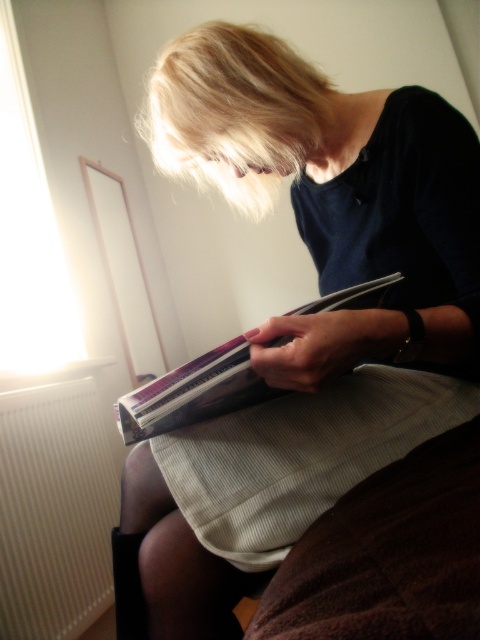
Question: Which object appears farthest from the camera in this image?

Choices:
 (A) white ribbed radiator at lower left
 (B) matte black clutch at center

Answer: (A)

Question: Can you confirm if matte black clutch at center is wider than striped fabric book at center?

Choices:
 (A) no
 (B) yes

Answer: (B)

Question: Does white ribbed radiator at lower left appear under striped fabric book at center?

Choices:
 (A) yes
 (B) no

Answer: (A)

Question: Considering the real-world distances, which object is farthest from the matte black clutch at center?

Choices:
 (A) striped fabric book at center
 (B) white ribbed radiator at lower left

Answer: (B)

Question: Which object is positioned farthest from the striped fabric book at center?

Choices:
 (A) matte black clutch at center
 (B) white ribbed radiator at lower left

Answer: (B)

Question: Is the position of matte black clutch at center less distant than that of striped fabric book at center?

Choices:
 (A) no
 (B) yes

Answer: (A)